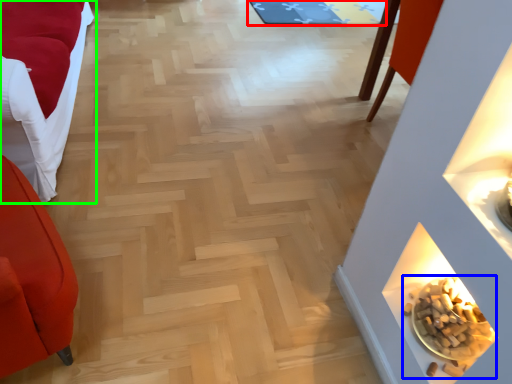
Question: Considering the real-world distances, which object is closest to mat (highlighted by a red box)? food (highlighted by a blue box) or furniture (highlighted by a green box).

Choices:
 (A) food
 (B) furniture

Answer: (B)